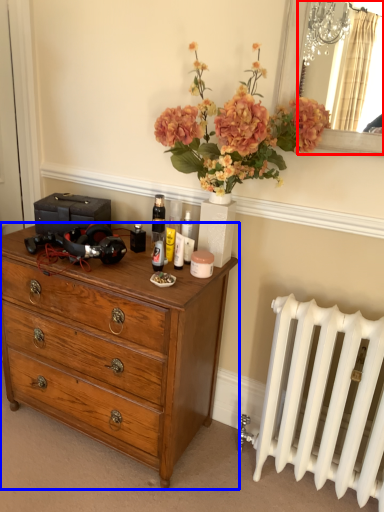
Question: Among these objects, which one is farthest to the camera, mirror (highlighted by a red box) or chest of drawers (highlighted by a blue box)?

Choices:
 (A) mirror
 (B) chest of drawers

Answer: (B)